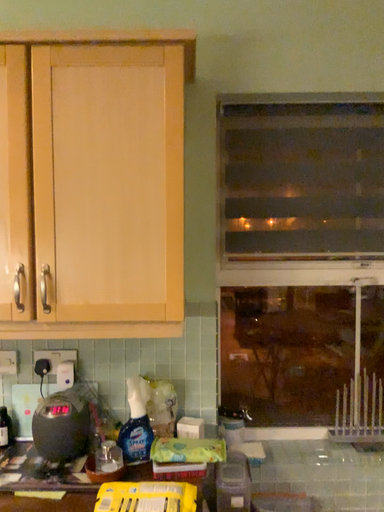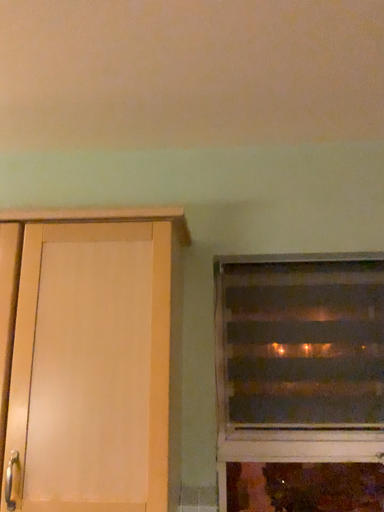
Question: Which way did the camera rotate in the video?

Choices:
 (A) rotated downward
 (B) rotated upward

Answer: (B)